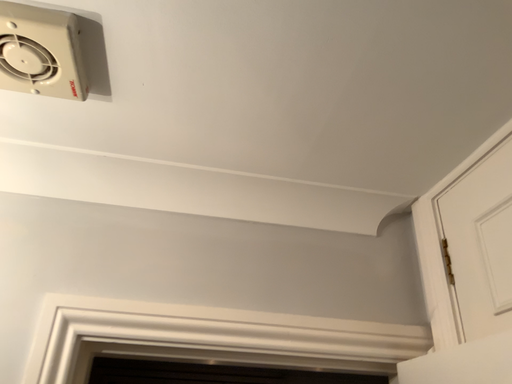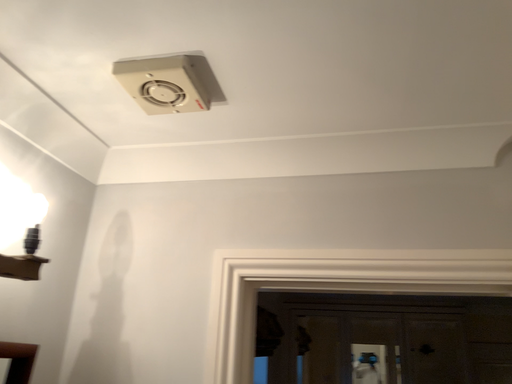
Question: How did the camera likely rotate when shooting the video?

Choices:
 (A) rotated downward
 (B) rotated upward

Answer: (A)